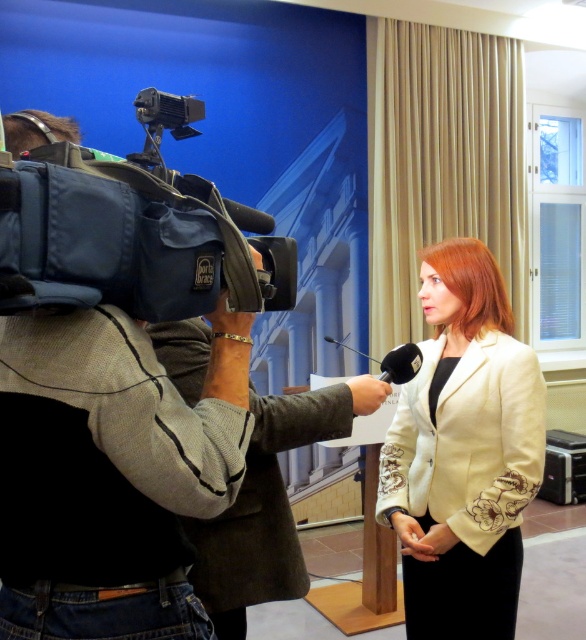
Question: Can you confirm if khaki fabric jacket at left is positioned below creamy satin blazer at center?

Choices:
 (A) no
 (B) yes

Answer: (A)

Question: Is khaki fabric jacket at left positioned behind creamy satin blazer at center?

Choices:
 (A) yes
 (B) no

Answer: (B)

Question: Which point is closer to the camera taking this photo?

Choices:
 (A) (202, 596)
 (B) (182, 476)
 (C) (56, 285)
 (D) (482, 358)

Answer: (C)

Question: Which point appears closest to the camera in this image?

Choices:
 (A) (407, 419)
 (B) (47, 472)
 (C) (240, 596)

Answer: (B)

Question: Among these objects, which one is nearest to the camera?

Choices:
 (A) blue fabric video camera at left
 (B) khaki fabric jacket at left
 (C) creamy satin blazer at center

Answer: (A)

Question: Is khaki fabric jacket at left wider than creamy satin blazer at center?

Choices:
 (A) yes
 (B) no

Answer: (B)